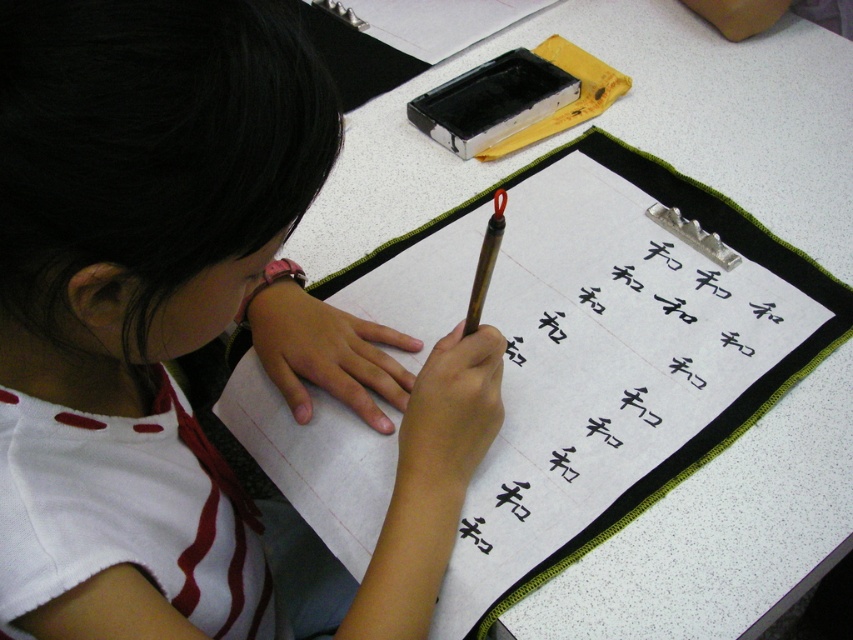
Question: Does white fabric shirt at center have a greater width compared to brown wooden pencil at center?

Choices:
 (A) yes
 (B) no

Answer: (A)

Question: Among these objects, which one is nearest to the camera?

Choices:
 (A) black fabric clipboard at center
 (B) white fabric shirt at center

Answer: (B)

Question: Which object is closer to the camera taking this photo?

Choices:
 (A) black fabric clipboard at center
 (B) brown wooden pencil at center
 (C) white fabric shirt at center

Answer: (C)

Question: Does black fabric clipboard at center appear on the left side of brown wooden pencil at center?

Choices:
 (A) no
 (B) yes

Answer: (A)

Question: Which of these objects is positioned farthest from the white fabric shirt at center?

Choices:
 (A) brown wooden pencil at center
 (B) black fabric clipboard at center

Answer: (A)

Question: Is white fabric shirt at center in front of brown wooden pencil at center?

Choices:
 (A) yes
 (B) no

Answer: (A)